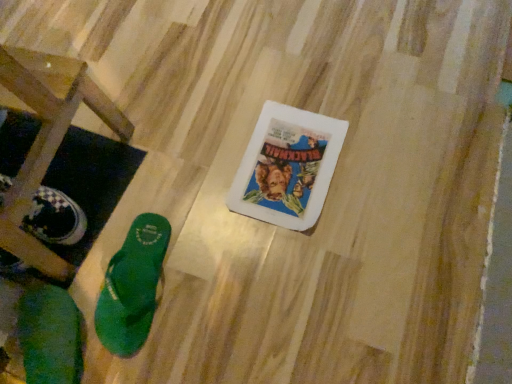
Question: From the image's perspective, is green rubber flip-flop at lower left, which is counted as the first footwear, starting from the right, located above or below wooden stool at lower left?

Choices:
 (A) below
 (B) above

Answer: (A)

Question: Is green rubber flip-flop at lower left, which is counted as the first footwear, starting from the right, to the left or to the right of wooden stool at lower left in the image?

Choices:
 (A) right
 (B) left

Answer: (A)

Question: Which object is the farthest from the green rubber flip-flop at lower left, which is counted as the first footwear, starting from the right?

Choices:
 (A) wooden stool at lower left
 (B) green fabric flip-flop at lower left, the second footwear viewed from the right

Answer: (A)

Question: Based on their relative distances, which object is farther from the green rubber flip-flop at lower left, acting as the 2th footwear starting from the left?

Choices:
 (A) green fabric flip-flop at lower left, the second footwear viewed from the right
 (B) wooden stool at lower left

Answer: (B)